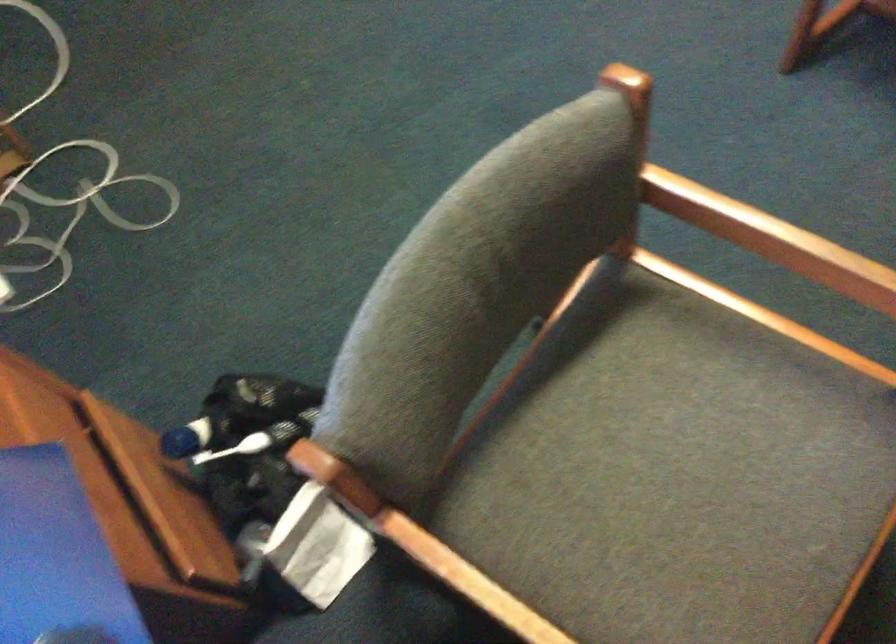
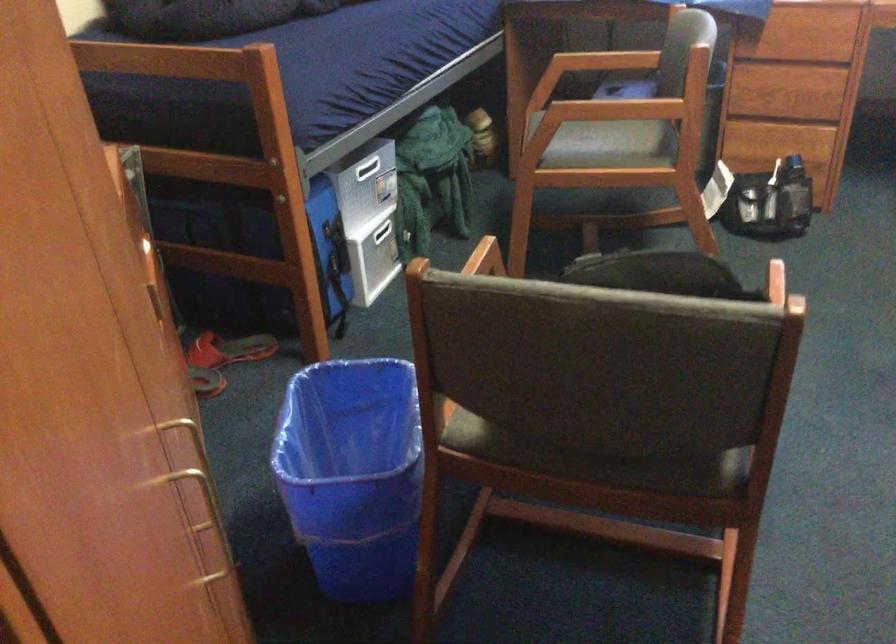
Where in the second image is the point corresponding to [700,438] from the first image?

(605, 145)